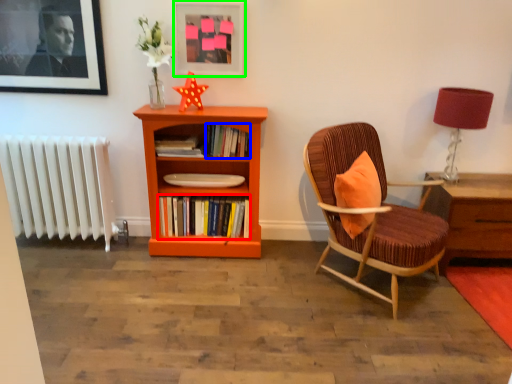
Question: Considering the real-world distances, which object is farthest from book (highlighted by a red box)? book (highlighted by a blue box) or picture frame (highlighted by a green box)?

Choices:
 (A) book
 (B) picture frame

Answer: (B)